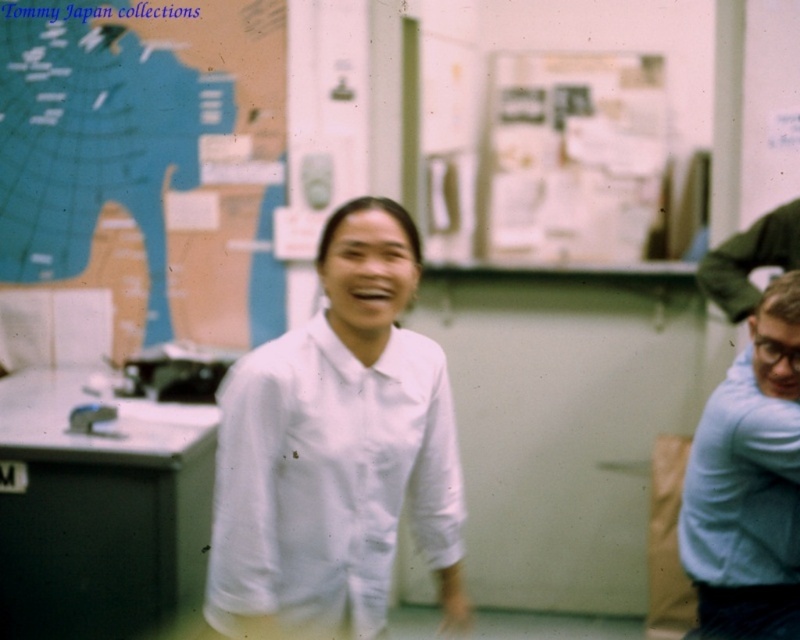
You are a photographer adjusting your camera settings to focus on the white paperboard at upper center and the light blue sweater at right. Which object should you focus on first if you want to capture both clearly in the same shot?

You should focus on the white paperboard at upper center first because it is closer to the viewer than the light blue sweater at right, ensuring both are in focus by focusing on the closer object.

You are taking a photo of the scene described. You want to focus on the white smooth shirt at center and the white paperboard at upper center. Which object should you adjust your camera focus to first if you want to ensure both are in focus?

The white smooth shirt at center is closer to the viewer than the white paperboard at upper center, so you should focus on the white smooth shirt at center first to ensure both are in focus.

You are standing in an office or laboratory setting where there is a large map on the left and a person wearing a white shirt at center. If you want to move closer to the white smooth shirt at center, which direction should you move from your current position?

Since the white smooth shirt at center is located at point [337,445], you should move towards the center of the image to get closer to it.